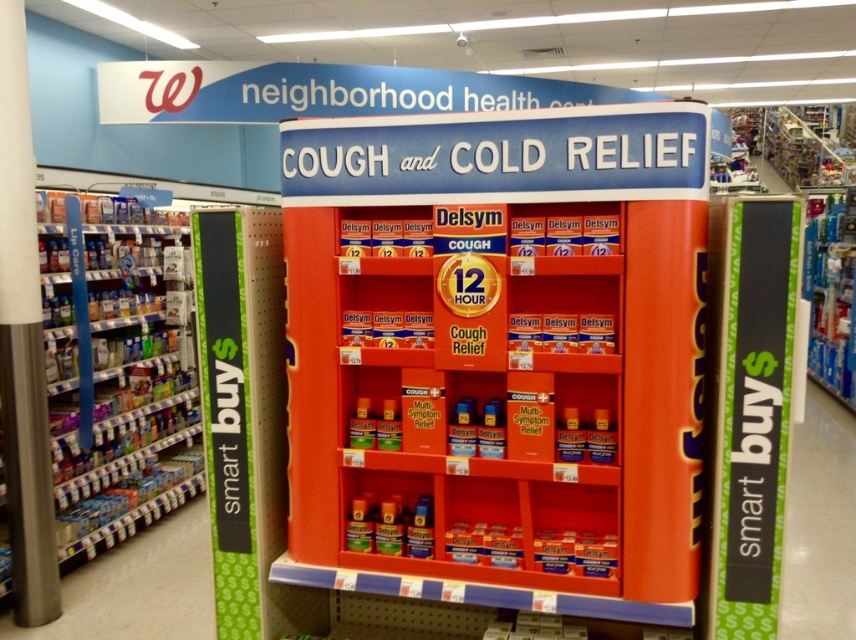
Question: Does matte plastic shelves at left have a smaller size compared to green matte signboard at right?

Choices:
 (A) no
 (B) yes

Answer: (A)

Question: Which point is farther to the camera?

Choices:
 (A) matte plastic shelves at left
 (B) green matte signboard at left

Answer: (A)

Question: Can you confirm if matte plastic shelves at left is positioned above green matte signboard at right?

Choices:
 (A) yes
 (B) no

Answer: (B)

Question: Based on their relative distances, which object is nearer to the green matte signboard at left?

Choices:
 (A) green matte signboard at right
 (B) matte plastic shelves at left

Answer: (A)

Question: Does green matte signboard at right have a lesser width compared to green matte signboard at left?

Choices:
 (A) no
 (B) yes

Answer: (B)

Question: Which point is closer to the camera?

Choices:
 (A) (67, 234)
 (B) (233, 436)
 (C) (756, 273)

Answer: (C)